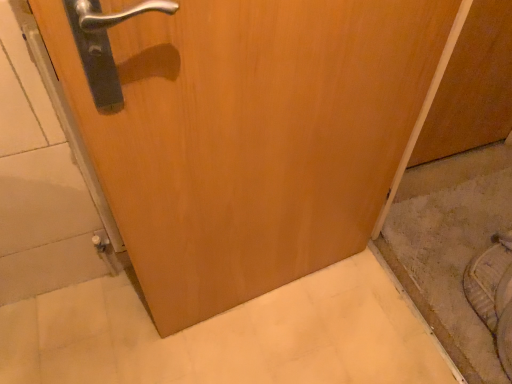
At what (x,y) coordinates should I click in order to perform the action: click on wooden door at lower right. Please return your answer as a coordinate pair (x, y). Image resolution: width=512 pixels, height=384 pixels. Looking at the image, I should click on (472, 87).

What is the approximate width of wooden door at lower right?

It is 6.95 centimeters.

Describe the element at coordinates (472, 87) in the screenshot. The height and width of the screenshot is (384, 512). I see `wooden door at lower right` at that location.

The height and width of the screenshot is (384, 512). I want to click on wooden door at lower right, so click(472, 87).